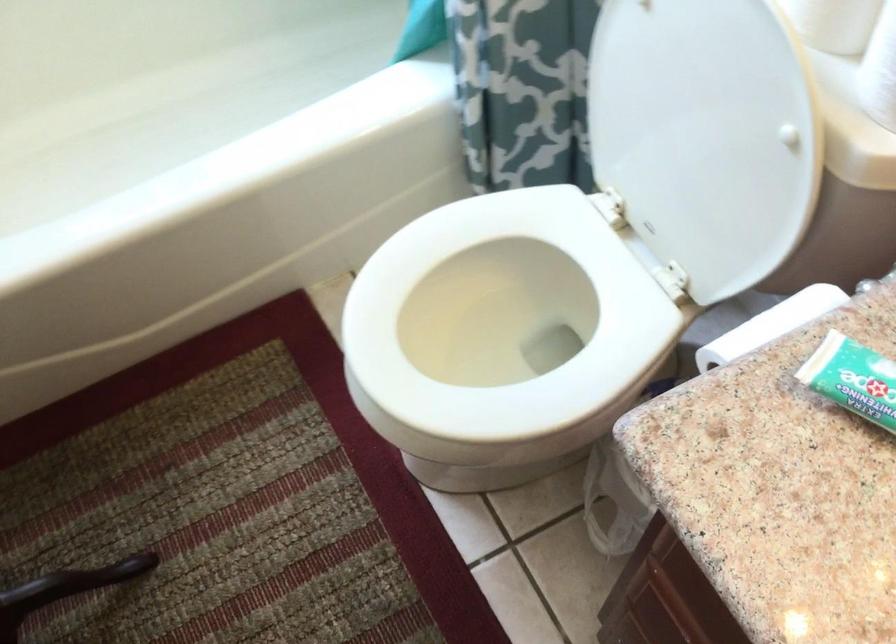
Identify the location of white toilet lid. (708, 71).